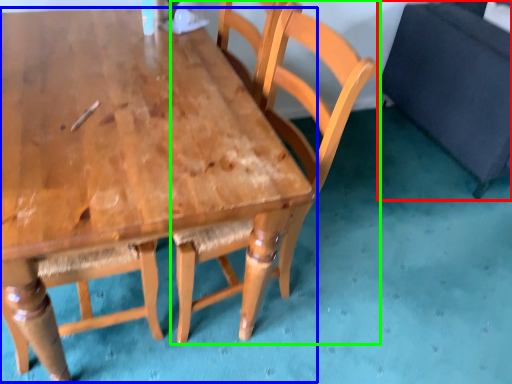
Question: Estimate the real-world distances between objects in this image. Which object is farther from swivel chair (highlighted by a red box), table (highlighted by a blue box) or chair (highlighted by a green box)?

Choices:
 (A) table
 (B) chair

Answer: (A)